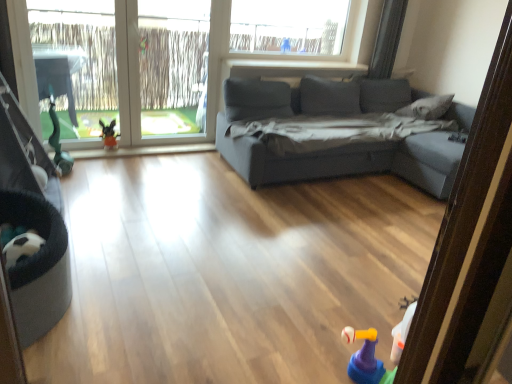
Question: Should I look upward or downward to see gray fabric pillow at upper right?

Choices:
 (A) down
 (B) up

Answer: (B)

Question: Is gray fabric pillow at upper right aimed at black fabric baby carriage at lower left?

Choices:
 (A) yes
 (B) no

Answer: (A)

Question: Is gray fabric pillow at upper right turned away from black fabric baby carriage at lower left?

Choices:
 (A) yes
 (B) no

Answer: (B)

Question: Is the position of gray fabric pillow at upper right less distant than that of black fabric baby carriage at lower left?

Choices:
 (A) no
 (B) yes

Answer: (A)

Question: Is gray fabric pillow at upper right outside of black fabric baby carriage at lower left?

Choices:
 (A) yes
 (B) no

Answer: (A)

Question: Does gray fabric pillow at upper right have a greater height compared to black fabric baby carriage at lower left?

Choices:
 (A) no
 (B) yes

Answer: (A)

Question: Can you confirm if gray fabric pillow at upper right is wider than black fabric baby carriage at lower left?

Choices:
 (A) no
 (B) yes

Answer: (B)

Question: Is rubberized yellow and purple toy at lower right to the right of plush toy at lower left from the viewer's perspective?

Choices:
 (A) no
 (B) yes

Answer: (B)

Question: Does rubberized yellow and purple toy at lower right have a greater width compared to plush toy at lower left?

Choices:
 (A) yes
 (B) no

Answer: (A)

Question: Is rubberized yellow and purple toy at lower right positioned before plush toy at lower left?

Choices:
 (A) no
 (B) yes

Answer: (B)

Question: Considering the relative positions of rubberized yellow and purple toy at lower right and plush toy at lower left in the image provided, is rubberized yellow and purple toy at lower right to the left of plush toy at lower left from the viewer's perspective?

Choices:
 (A) no
 (B) yes

Answer: (A)

Question: Would you say plush toy at lower left is part of rubberized yellow and purple toy at lower right's contents?

Choices:
 (A) yes
 (B) no

Answer: (B)

Question: Is rubberized yellow and purple toy at lower right far away from plush toy at lower left?

Choices:
 (A) no
 (B) yes

Answer: (B)

Question: Is plush toy at lower left in front of rubberized yellow and purple toy at lower right?

Choices:
 (A) yes
 (B) no

Answer: (B)